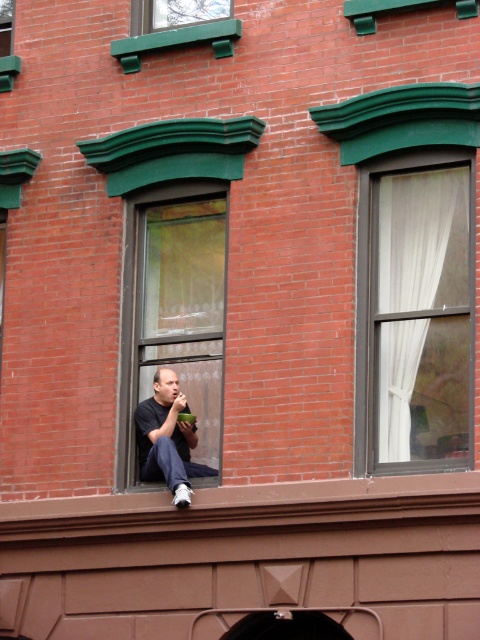
You are standing in front of the brick building and see two points marked on the wall. Which point is closer to you, point (191, 476) or point (159, 6)?

Point (191, 476) is in front of point (159, 6), so it is closer to you.

You are standing in front of the brick building and see the clear glass window at center and the dark blue jeans at center. Which object is positioned to the left?

The clear glass window at center is to the left of the dark blue jeans at center, so the clear glass window at center is positioned to the left.

You are standing in front of the brick building and want to see the man eating from his bowl. Which object, the clear glass window at center or the dark blue jeans at center, is closer to you?

The clear glass window at center is closer to you than the dark blue jeans at center.